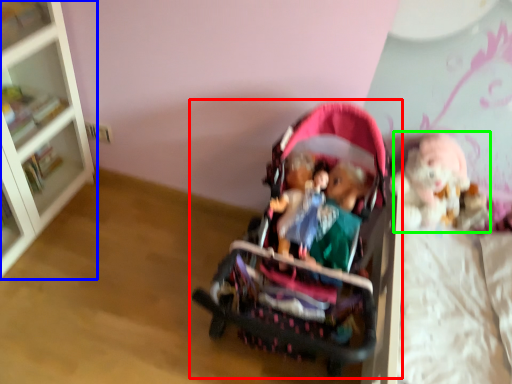
Question: Estimate the real-world distances between objects in this image. Which object is farther from toy (highlighted by a red box), bookcase (highlighted by a blue box) or doll (highlighted by a green box)?

Choices:
 (A) bookcase
 (B) doll

Answer: (A)